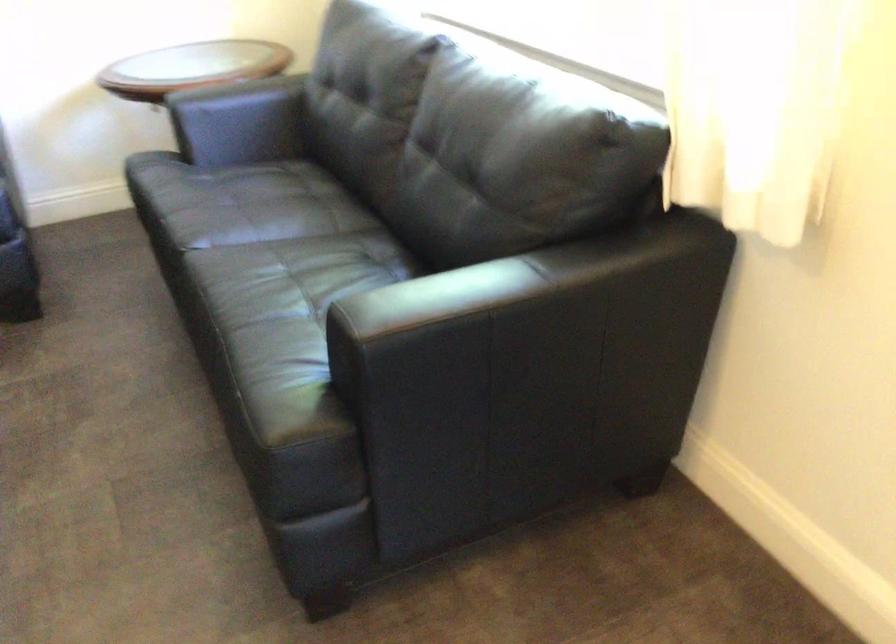
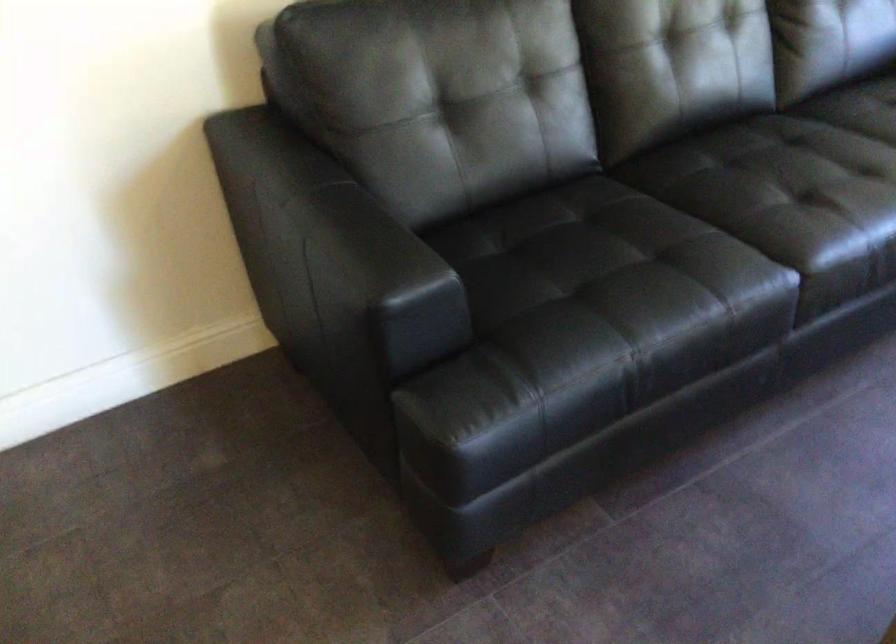
Question: The images are taken continuously from a first-person perspective. In which direction are you moving?

Choices:
 (A) Left
 (B) Right
 (C) Forward
 (D) Backward

Answer: (A)